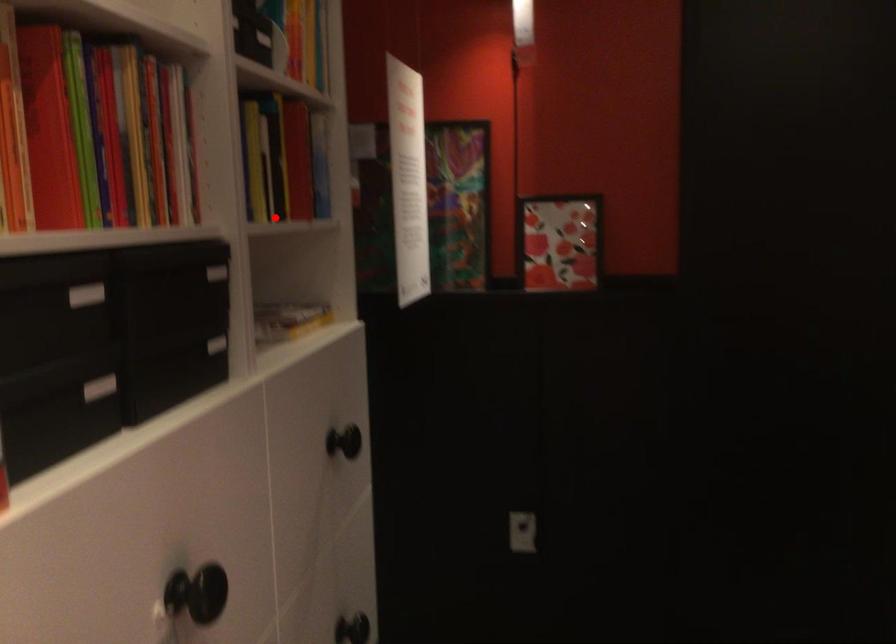
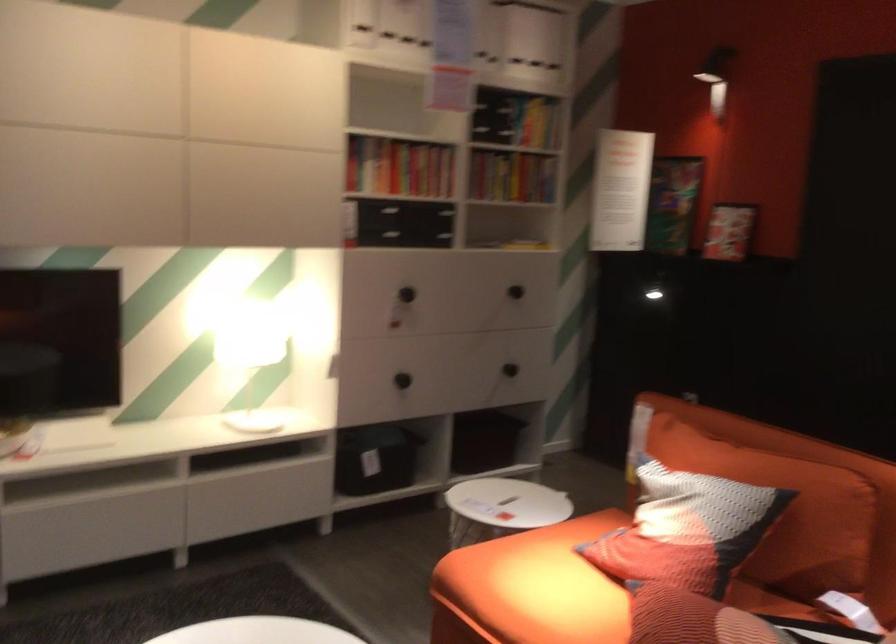
Question: I am providing you with two images of the same scene from different viewpoints. A red point is shown in image1. For the corresponding object point in image2, is it positioned nearer or farther from the camera?

Choices:
 (A) Nearer
 (B) Farther

Answer: (B)